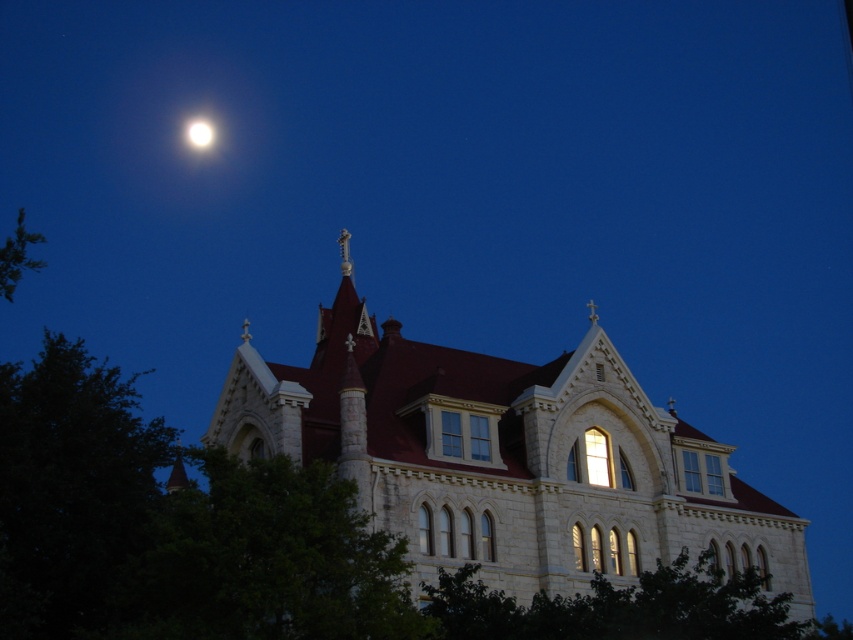
Question: Is white stone church at center smaller than bright white orb at upper left?

Choices:
 (A) no
 (B) yes

Answer: (A)

Question: Can you confirm if bright white orb at upper center is positioned to the left of bright white orb at upper left?

Choices:
 (A) yes
 (B) no

Answer: (A)

Question: Based on their relative distances, which object is farther from the white stone church at center?

Choices:
 (A) bright white orb at upper center
 (B) bright white orb at upper left

Answer: (B)

Question: Which point is farther to the camera?

Choices:
 (A) (318, 426)
 (B) (206, 144)

Answer: (B)

Question: Does bright white orb at upper center appear under bright white orb at upper left?

Choices:
 (A) no
 (B) yes

Answer: (B)

Question: Among these points, which one is farthest from the camera?

Choices:
 (A) (209, 125)
 (B) (204, 141)

Answer: (B)